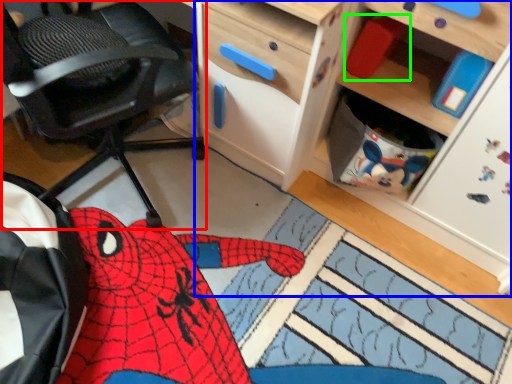
Question: Which object is the farthest from chair (highlighted by a red box)? Choose among these: cabinetry (highlighted by a blue box) or toy (highlighted by a green box).

Choices:
 (A) cabinetry
 (B) toy

Answer: (B)